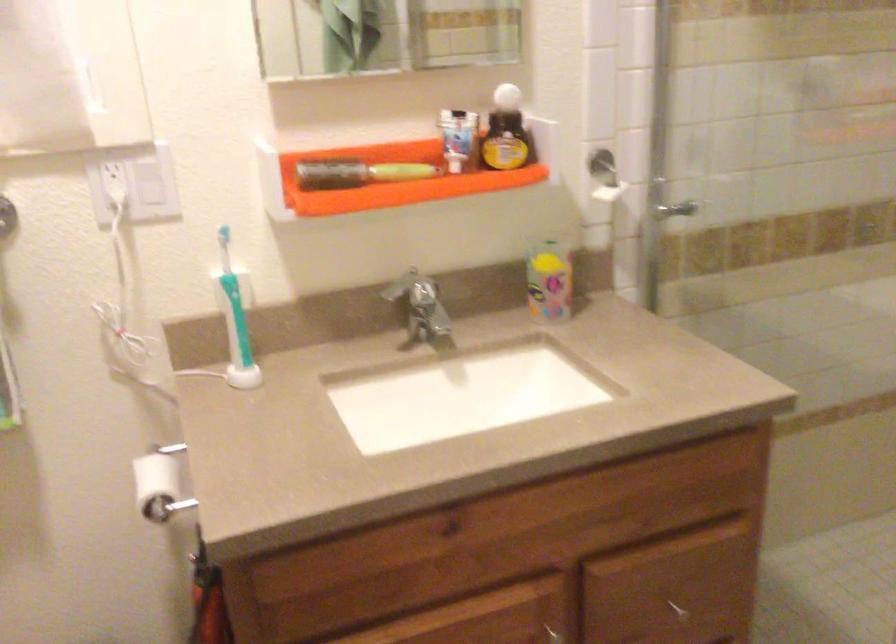
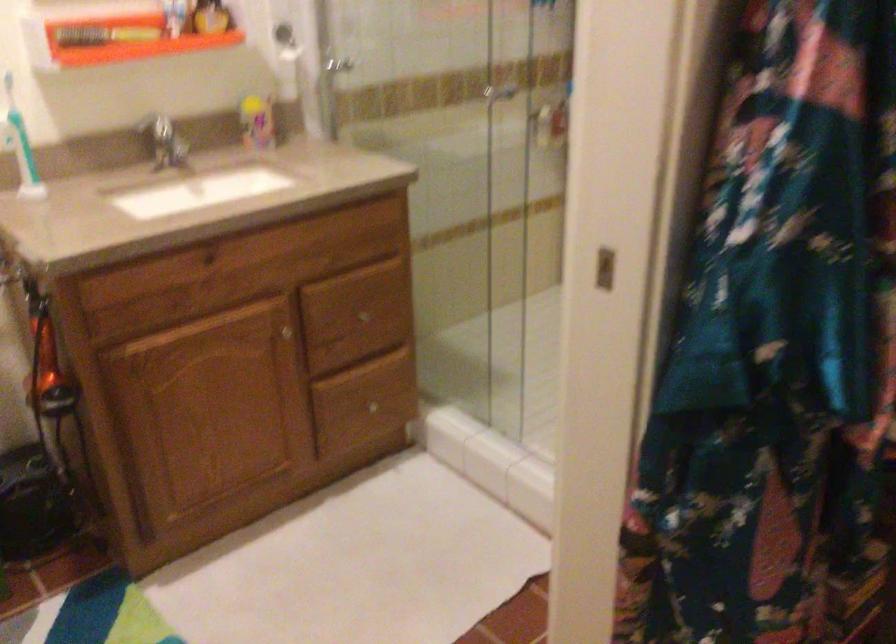
Question: How did the camera likely rotate?

Choices:
 (A) Left
 (B) Right
 (C) Up
 (D) Down

Answer: (B)